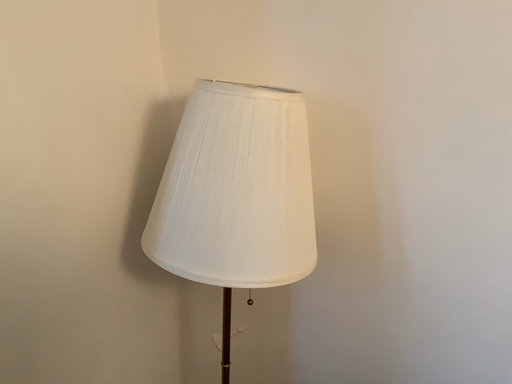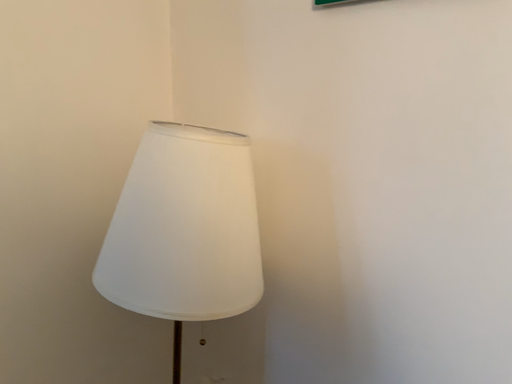
Question: How did the camera likely rotate when shooting the video?

Choices:
 (A) rotated left
 (B) rotated right

Answer: (A)